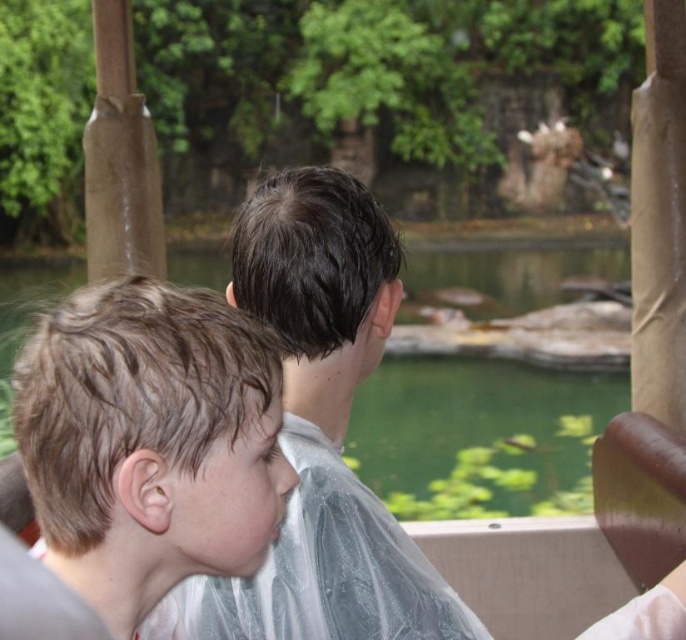
Question: Does light brown hair at left have a larger size compared to transparent plastic water at center?

Choices:
 (A) yes
 (B) no

Answer: (B)

Question: Which of the following is the closest to the observer?

Choices:
 (A) translucent plastic bag at center
 (B) transparent plastic water at center

Answer: (A)

Question: Which of these objects is positioned farthest from the transparent plastic water at center?

Choices:
 (A) translucent plastic bag at center
 (B) light brown hair at left

Answer: (B)

Question: Which object is positioned farthest from the light brown hair at left?

Choices:
 (A) translucent plastic bag at center
 (B) transparent plastic water at center

Answer: (B)

Question: Is light brown hair at left further to the viewer compared to transparent plastic water at center?

Choices:
 (A) no
 (B) yes

Answer: (A)

Question: Is translucent plastic bag at center smaller than transparent plastic water at center?

Choices:
 (A) yes
 (B) no

Answer: (A)